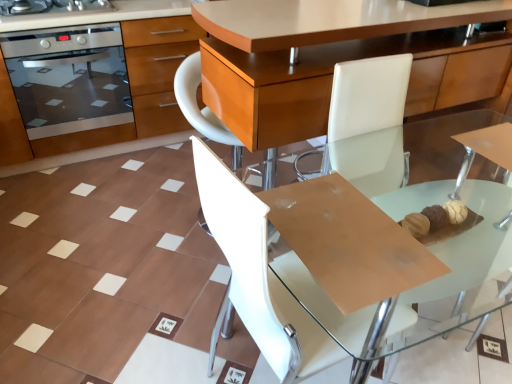
Question: Is stainless steel oven at left wider or thinner than stainless steel oven at left?

Choices:
 (A) wide
 (B) thin

Answer: (B)

Question: Considering their positions, is stainless steel oven at left located in front of or behind stainless steel oven at left?

Choices:
 (A) behind
 (B) front

Answer: (A)

Question: Considering the real-world distances, which object is closest to the stainless steel oven at left?

Choices:
 (A) stainless steel oven at left
 (B) stainless steel oven at upper left
 (C) white leather chair at center
 (D) transparent glass table at center

Answer: (A)

Question: Based on their relative distances, which object is nearer to the white leather chair at center?

Choices:
 (A) stainless steel oven at left
 (B) transparent glass table at center
 (C) stainless steel oven at left
 (D) stainless steel oven at upper left

Answer: (B)